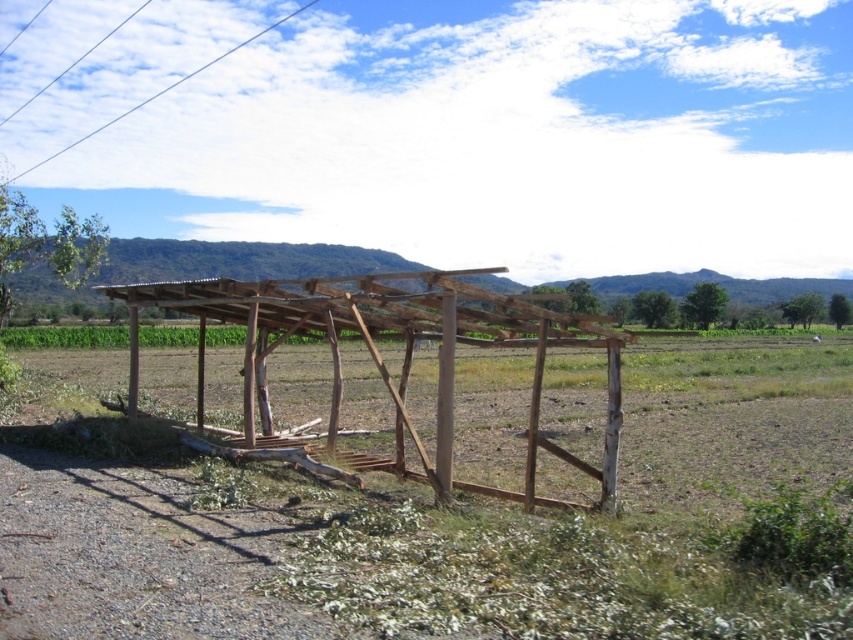
You are a farmer standing in the field and see the brown wooden structure at center and the white wire at upper left. Which object is taller?

The white wire at upper left is taller than the brown wooden structure at center.

You are standing at point (403, 355) in the rural scene. What object is located exactly at your current position?

The brown wooden structure at center is located exactly at point (403, 355).

You are standing at point (613, 358) and want to walk to the shelter. The shelter is 8.73 meters away. Is the shelter closer to you than 10 meters?

The shelter is 8.73 meters away from point (613, 358), so yes, the shelter is closer than 10 meters.